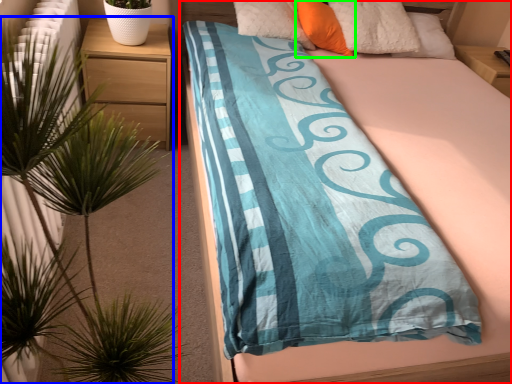
Question: Which object is the closest to the bed (highlighted by a red box)? Choose among these: houseplant (highlighted by a blue box) or pillow (highlighted by a green box).

Choices:
 (A) houseplant
 (B) pillow

Answer: (B)